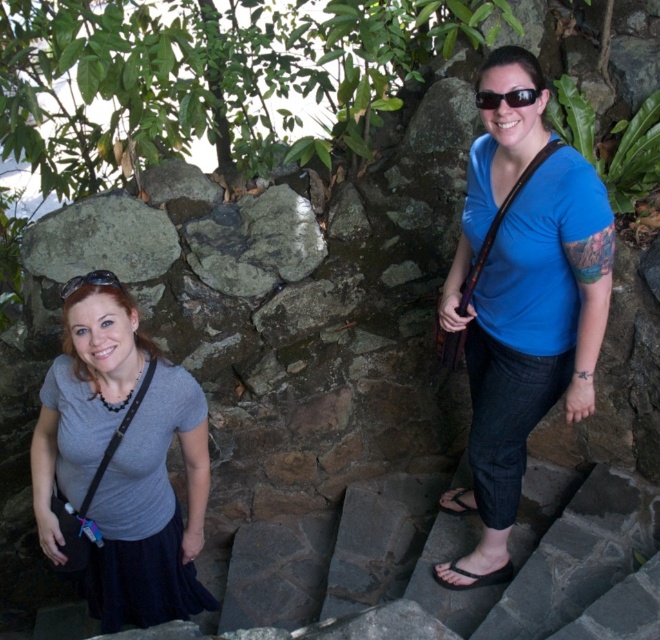
You are standing at the point marked by the coordinate point at point (486, 540). You want to walk to the nearest person. Which direction should you go?

The two people are 9.39 feet apart. Since you are at point (486, 540), you need to determine which person is closer based on their positions. However, without additional spatial information about their exact coordinates, it is impossible to determine the direction to the nearest person.